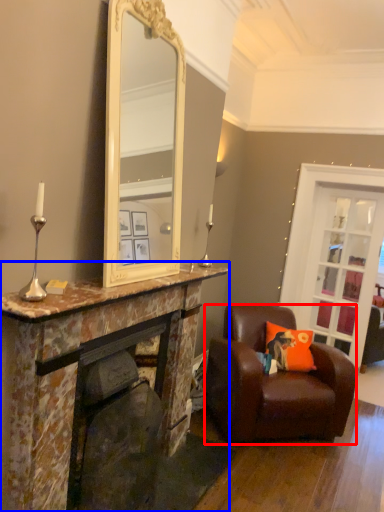
Question: Which of the following is the closest to the observer, chair (highlighted by a red box) or cabinetry (highlighted by a blue box)?

Choices:
 (A) chair
 (B) cabinetry

Answer: (B)